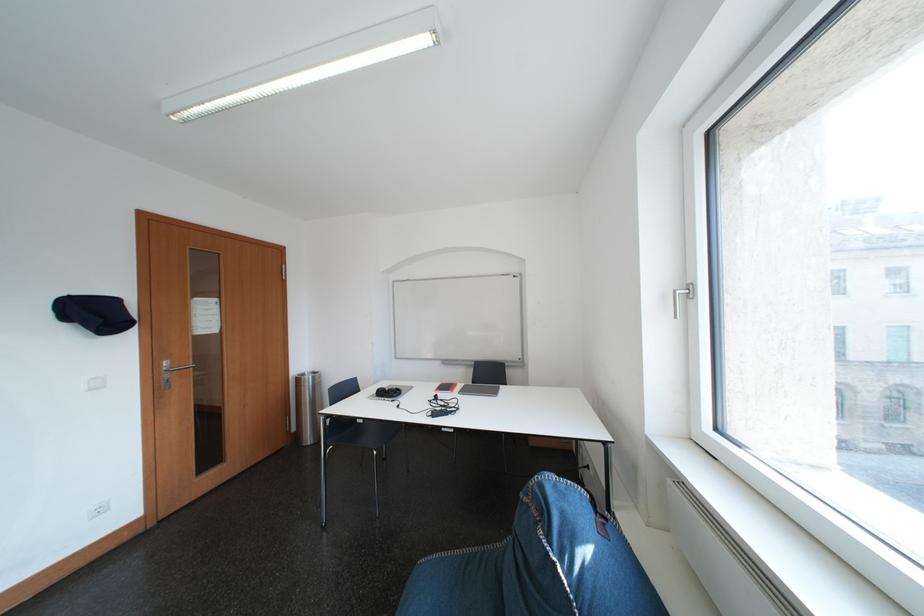
Where would you turn the silver window handle? Please return your answer as a coordinate pair (x, y).

(677, 301)